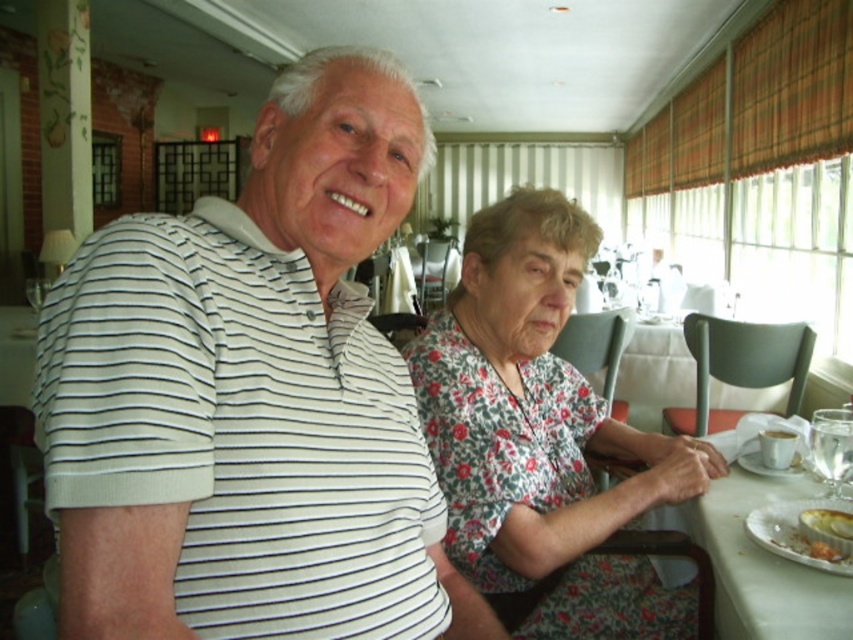
You are a photographer standing in front of the table. You want to take a photo of the white striped polo shirt at left and the floral fabric dress at center. Which one will appear larger in the photo?

The white striped polo shirt at left will appear larger in the photo because it is closer to the viewer than the floral fabric dress at center.

You are a photographer trying to capture both the white striped polo shirt at left and the floral fabric dress at center in the same frame. Based on their heights, which clothing item will appear smaller in the photo?

The white striped polo shirt at left will appear smaller in the photo because it is not as tall as the floral fabric dress at center.